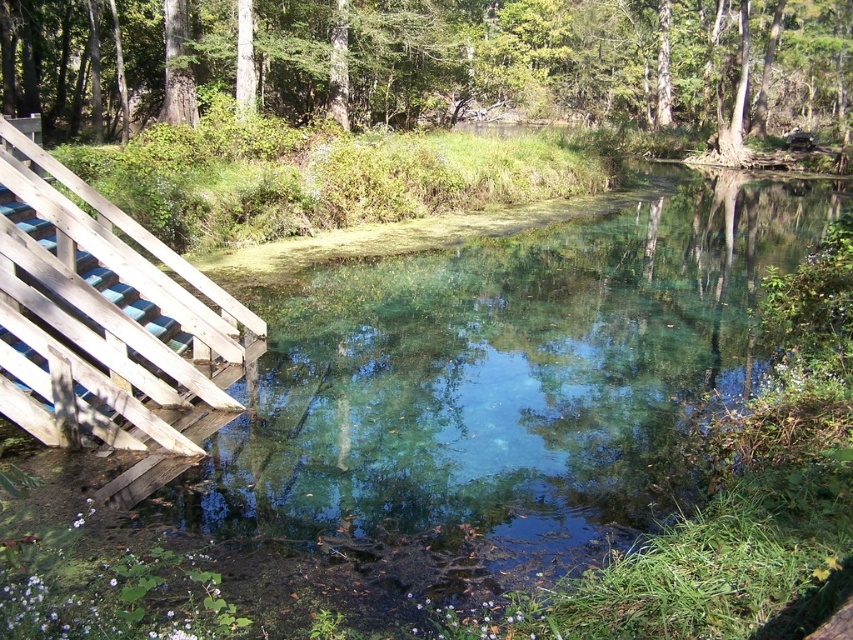
Between green leafy tree at upper center and wooden planks at left, which one appears on the left side from the viewer's perspective?

From the viewer's perspective, wooden planks at left appears more on the left side.

Is green leafy tree at upper center shorter than wooden planks at left?

Incorrect, green leafy tree at upper center's height does not fall short of wooden planks at left's.

Is point (614, 68) closer to viewer compared to point (61, 243)?

No, it is behind (61, 243).

At what (x,y) coordinates should I click in order to perform the action: click on green leafy tree at upper center. Please return your answer as a coordinate pair (x, y). Image resolution: width=853 pixels, height=640 pixels. Looking at the image, I should click on (434, 61).